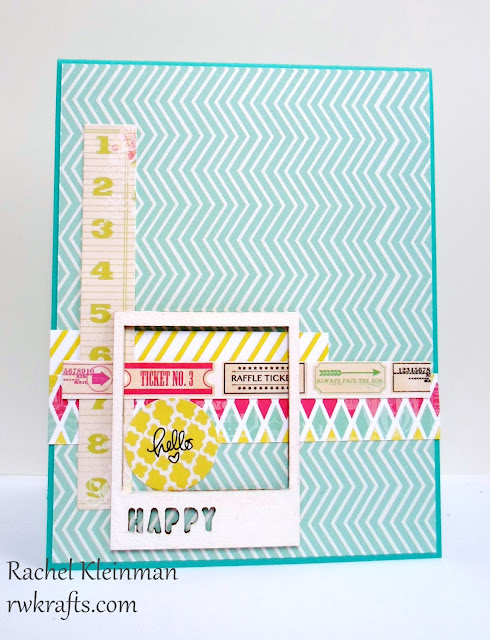
This screenshot has width=490, height=640. What are the coordinates of `polaroid photo` in the screenshot? It's located at (248, 506).